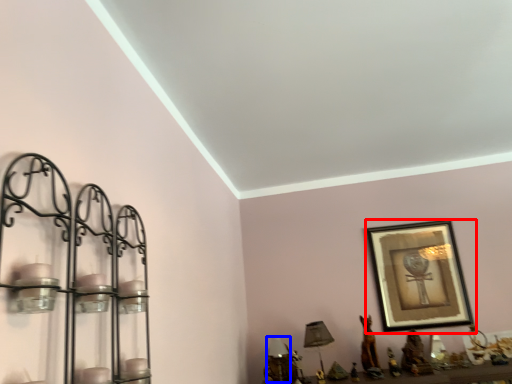
Question: Which of the following is the farthest to the observer, picture frame (highlighted by a red box) or table lamp (highlighted by a blue box)?

Choices:
 (A) picture frame
 (B) table lamp

Answer: (A)